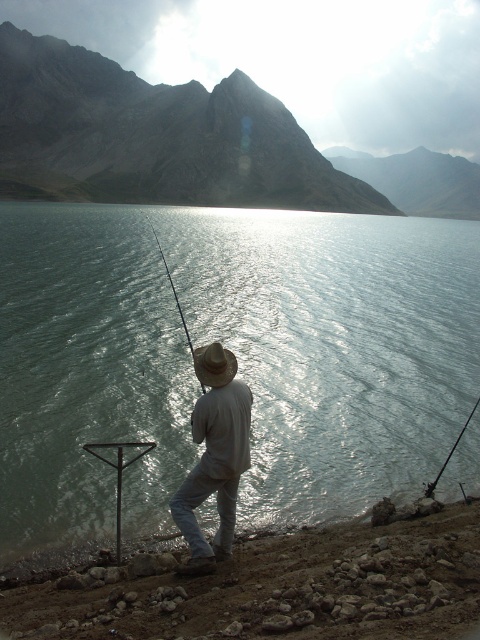
Can you confirm if white cotton shirt at center is thinner than shiny metallic fishing pole at center?

Correct, white cotton shirt at center's width is less than shiny metallic fishing pole at center's.

Can you confirm if white cotton shirt at center is positioned below shiny metallic fishing pole at center?

Yes.

Is point (228, 509) positioned in front of point (186, 337)?

Yes, it is in front of point (186, 337).

This screenshot has width=480, height=640. In order to click on white cotton shirt at center in this screenshot , I will do `click(215, 456)`.

Is dull brown dirt at lower right wider than brown woven straw hat at center?

No, dull brown dirt at lower right is not wider than brown woven straw hat at center.

Does dull brown dirt at lower right appear on the left side of brown woven straw hat at center?

Yes, dull brown dirt at lower right is to the left of brown woven straw hat at center.

Who is more distant from viewer, (302, 563) or (208, 385)?

Positioned behind is point (302, 563).

Locate an element on the screen. The height and width of the screenshot is (640, 480). dull brown dirt at lower right is located at coordinates (277, 588).

Between point (222, 417) and point (446, 461), which one is positioned behind?

The point (446, 461) is behind.

Which of these two, white cotton shirt at center or smooth black rod at center, stands taller?

Standing taller between the two is white cotton shirt at center.

Which is behind, point (228, 381) or point (435, 477)?

The point (435, 477) is behind.

What are the coordinates of `white cotton shirt at center` in the screenshot? It's located at (215, 456).